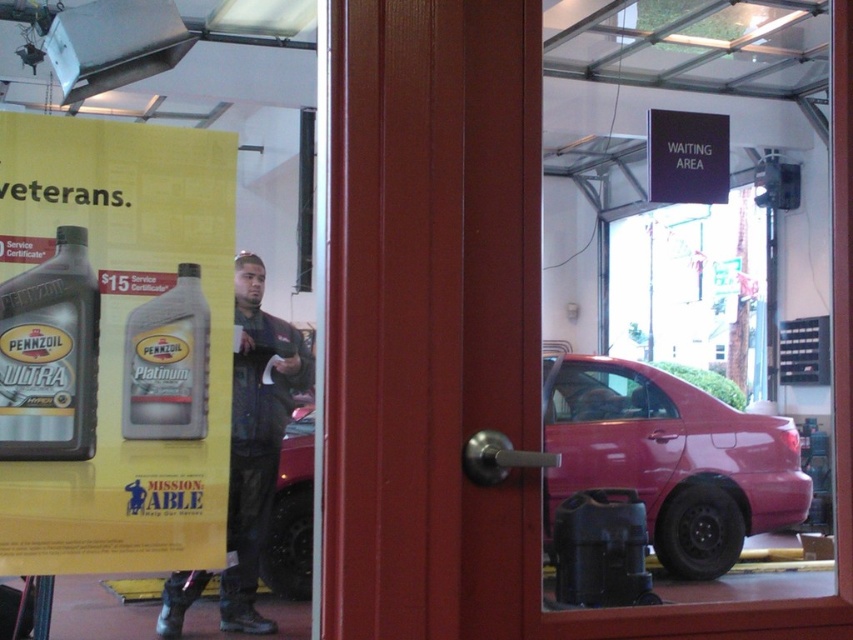
Does metallic red car at center have a greater width compared to black plastic sign at upper center?

In fact, metallic red car at center might be narrower than black plastic sign at upper center.

Who is higher up, metallic red car at center or black plastic sign at upper center?

black plastic sign at upper center is higher up.

Between point (286, 436) and point (694, 164), which one is positioned behind?

The point (694, 164) is behind.

Find the location of a particular element. This screenshot has height=640, width=853. metallic red car at center is located at coordinates (291, 513).

Who is taller, dark gray uniform at center or black plastic sign at upper center?

dark gray uniform at center is taller.

Between dark gray uniform at center and black plastic sign at upper center, which one is positioned lower?

dark gray uniform at center is lower down.

The width and height of the screenshot is (853, 640). What do you see at coordinates (256, 436) in the screenshot?
I see `dark gray uniform at center` at bounding box center [256, 436].

The image size is (853, 640). Identify the location of dark gray uniform at center. 256,436.

Is point (686, 616) more distant than point (136, 438)?

No, it is in front of (136, 438).

Consider the image. Is transparent glass door at center above matte black bottle at left?

Indeed, transparent glass door at center is positioned over matte black bottle at left.

Identify the location of transparent glass door at center. The image size is (853, 640). (834, 442).